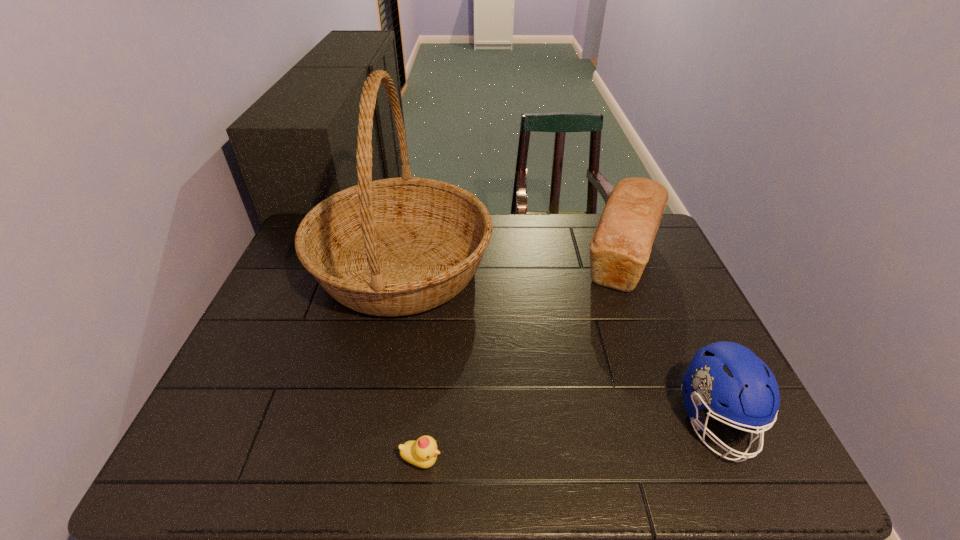
Locate an element on the screen. the tallest object is located at coordinates (400, 246).

Identify the location of the third shortest object. The image size is (960, 540). (620, 247).

Where is `the second shortest object`? the second shortest object is located at coordinates (723, 372).

Find the location of `the shortest object`. the shortest object is located at coordinates (423, 452).

Where is `vacant space located 0.140m on the right of the tallest object`? The width and height of the screenshot is (960, 540). vacant space located 0.140m on the right of the tallest object is located at coordinates (538, 268).

Identify the location of free space located on the left of the bread. (449, 259).

The width and height of the screenshot is (960, 540). What are the coordinates of `vacant space located 0.150m on the front-facing side of the shortest object` in the screenshot? It's located at (516, 461).

The height and width of the screenshot is (540, 960). I want to click on basket located in the far edge section of the desktop, so click(x=400, y=246).

Where is `bread at the far edge`? The image size is (960, 540). bread at the far edge is located at coordinates (620, 247).

Where is `football helmet positioned at the near edge`? football helmet positioned at the near edge is located at coordinates (723, 372).